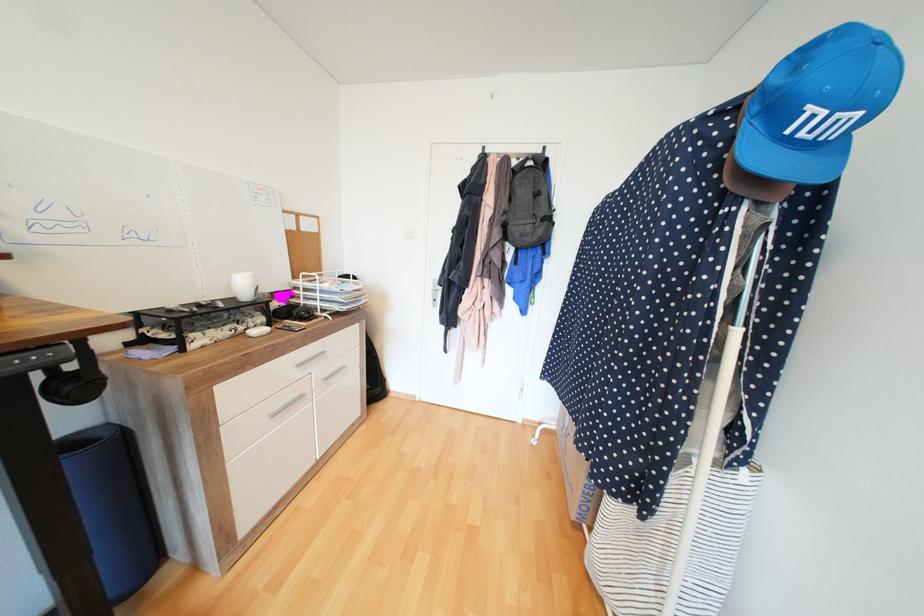
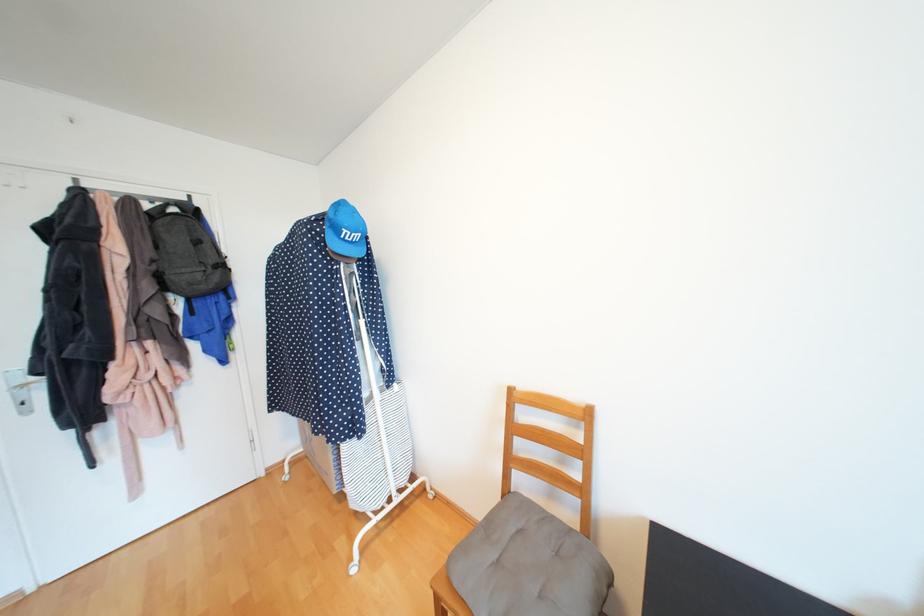
In the second image, find the point that corresponds to (x=807, y=134) in the first image.

(353, 238)